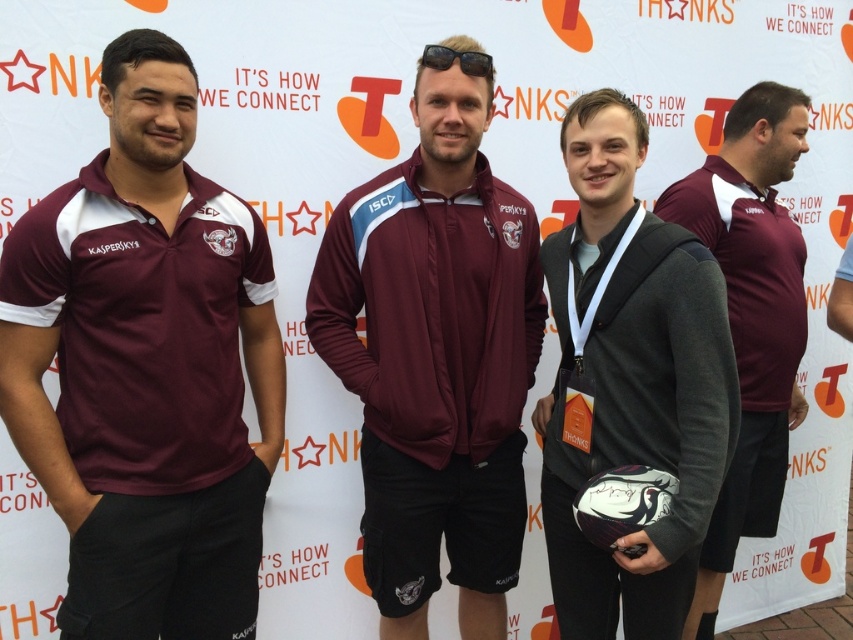
Can you confirm if maroon jersey at center is positioned to the left of black plastic sunglasses at center?

In fact, maroon jersey at center is to the right of black plastic sunglasses at center.

Does point (622, 614) come farther from viewer compared to point (462, 67)?

Yes.

You are a GUI agent. You are given a task and a screenshot of the screen. Output one action in this format:
    pyautogui.click(x=<x>, y=<y>)
    Task: Click on the maroon jersey at center
    The width and height of the screenshot is (853, 640).
    Given the screenshot: What is the action you would take?
    pyautogui.click(x=630, y=381)

At what (x,y) coordinates should I click in order to perform the action: click on maroon jersey at center. Please return your answer as a coordinate pair (x, y). Looking at the image, I should click on (630, 381).

Is maroon jersey at center to the left of maroon jersey at right from the viewer's perspective?

Indeed, maroon jersey at center is positioned on the left side of maroon jersey at right.

Can you confirm if maroon jersey at center is thinner than maroon jersey at right?

Yes.

Describe the element at coordinates (630, 381) in the screenshot. The height and width of the screenshot is (640, 853). I see `maroon jersey at center` at that location.

Identify the location of maroon jersey at center. (630, 381).

Can you confirm if maroon fabric jacket at center is positioned below maroon jersey at right?

No.

Is point (498, 580) positioned before point (749, 340)?

Yes, point (498, 580) is closer to viewer.

Identify the location of maroon fabric jacket at center. This screenshot has height=640, width=853. (436, 358).